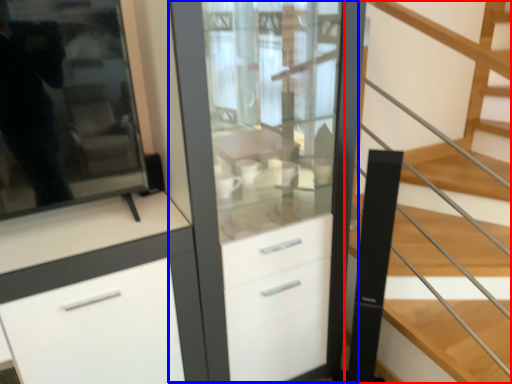
Question: Among these objects, which one is nearest to the camera, stairs (highlighted by a red box) or dresser (highlighted by a blue box)?

Choices:
 (A) stairs
 (B) dresser

Answer: (A)